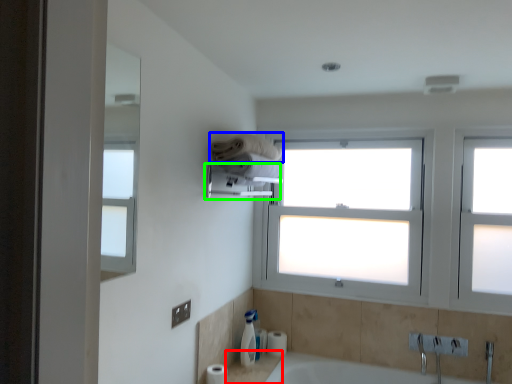
Question: Which object is positioned closest to counter top (highlighted by a red box)? Select from towel (highlighted by a blue box) and towel bar (highlighted by a green box).

Choices:
 (A) towel
 (B) towel bar

Answer: (B)